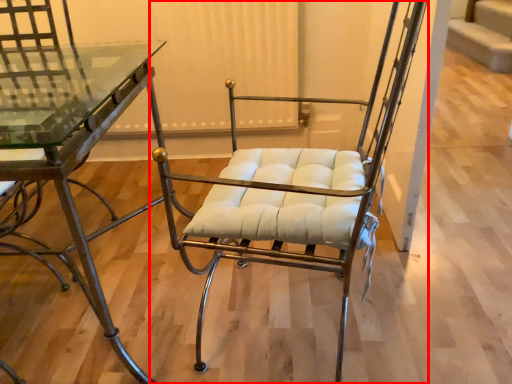
Question: Observing the image, what is the correct spatial positioning of chair (annotated by the red box) in reference to table?

Choices:
 (A) right
 (B) left

Answer: (A)